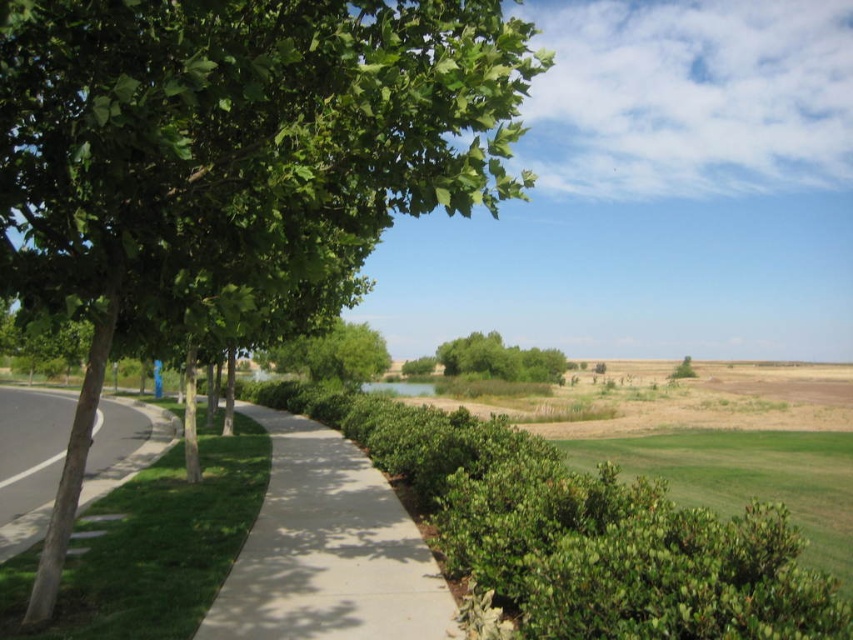
From the picture: Is concrete sidewalk at center above green leafy bush at center?

Correct, concrete sidewalk at center is located above green leafy bush at center.

Does point (346, 608) come behind point (686, 483)?

That is False.

I want to click on concrete sidewalk at center, so click(328, 550).

Which is below, green leafy bush at center or green leafy tree at center?

green leafy bush at center is lower down.

Who is taller, green leafy bush at center or green leafy tree at center?

Standing taller between the two is green leafy tree at center.

Where is `green leafy bush at center`? This screenshot has width=853, height=640. green leafy bush at center is located at coordinates (x=747, y=477).

Who is higher up, green soft grass at left or green leafy tree at center?

green leafy tree at center is above.

Can you confirm if green soft grass at left is positioned to the left of green leafy tree at center?

In fact, green soft grass at left is to the right of green leafy tree at center.

This screenshot has width=853, height=640. Describe the element at coordinates (151, 545) in the screenshot. I see `green soft grass at left` at that location.

Locate an element on the screen. green soft grass at left is located at coordinates (151, 545).